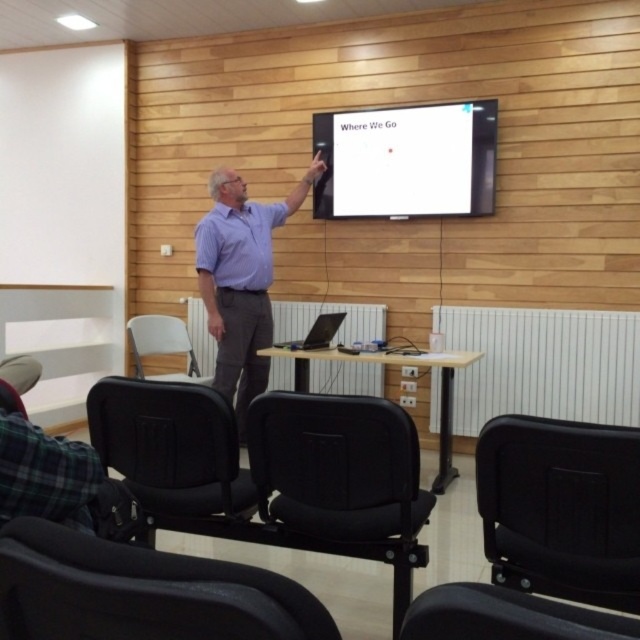
Does black plastic chair at lower right appear on the left side of satin black laptop at center?

No, black plastic chair at lower right is not to the left of satin black laptop at center.

Consider the image. Does black plastic chair at lower right have a greater width compared to satin black laptop at center?

Incorrect, black plastic chair at lower right's width does not surpass satin black laptop at center's.

You are a GUI agent. You are given a task and a screenshot of the screen. Output one action in this format:
    pyautogui.click(x=<x>, y=<y>)
    Task: Click on the black plastic chair at lower right
    This screenshot has width=640, height=640.
    Given the screenshot: What is the action you would take?
    pyautogui.click(x=561, y=508)

Locate an element on the screen. This screenshot has width=640, height=640. black plastic chair at lower right is located at coordinates (561, 508).

Does black plastic armchair at lower left lie in front of white plastic chair at lower left?

That is True.

Which of these two, black plastic armchair at lower left or white plastic chair at lower left, stands shorter?

black plastic armchair at lower left

Who is more forward, (136, 572) or (176, 348)?

Point (136, 572)

Where is `black plastic armchair at lower left`? The width and height of the screenshot is (640, 640). black plastic armchair at lower left is located at coordinates (141, 593).

Can you confirm if black plastic chair at lower right is smaller than black leather armchair at center?

Yes, black plastic chair at lower right is smaller than black leather armchair at center.

Who is more forward, (582, 572) or (264, 538)?

Positioned in front is point (582, 572).

Between point (525, 426) and point (291, 483), which one is positioned in front?

Point (525, 426) is more forward.

The width and height of the screenshot is (640, 640). I want to click on black plastic chair at lower right, so click(x=561, y=508).